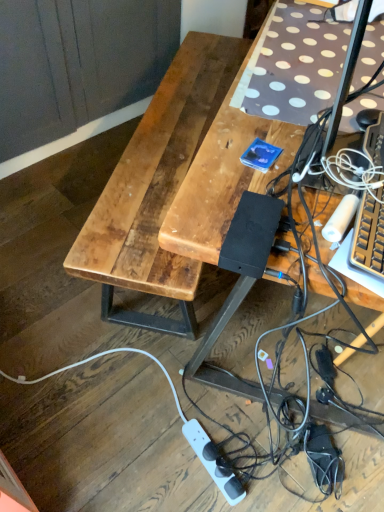
Image resolution: width=384 pixels, height=512 pixels. In order to click on free space above wooden desk at center (from a real-world perspective) in this screenshot , I will do `click(312, 75)`.